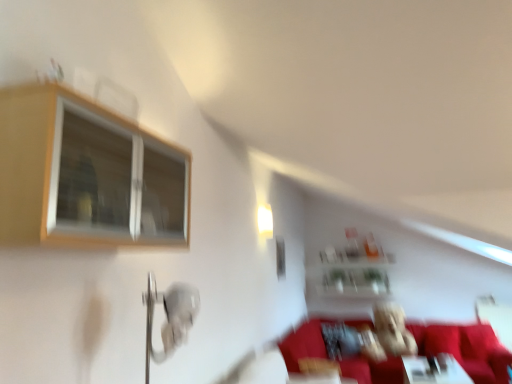
Question: Is fuzzy fabric teddy bear at center wider than white glossy light fixture at upper center?

Choices:
 (A) yes
 (B) no

Answer: (A)

Question: Does fuzzy fabric teddy bear at center come behind white glossy light fixture at upper center?

Choices:
 (A) no
 (B) yes

Answer: (B)

Question: Can you confirm if fuzzy fabric teddy bear at center is positioned to the left of white glossy light fixture at upper center?

Choices:
 (A) no
 (B) yes

Answer: (A)

Question: Does fuzzy fabric teddy bear at center turn towards white glossy light fixture at upper center?

Choices:
 (A) no
 (B) yes

Answer: (A)

Question: From a real-world perspective, is fuzzy fabric teddy bear at center on top of white glossy light fixture at upper center?

Choices:
 (A) yes
 (B) no

Answer: (B)

Question: From the image's perspective, is fuzzy fabric teddy bear at center below white glossy light fixture at upper center?

Choices:
 (A) no
 (B) yes

Answer: (B)

Question: Is there a large distance between wooden frame window at upper left and white glossy table at lower right?

Choices:
 (A) no
 (B) yes

Answer: (B)

Question: Is wooden frame window at upper left facing towards white glossy table at lower right?

Choices:
 (A) no
 (B) yes

Answer: (A)

Question: Is wooden frame window at upper left smaller than white glossy table at lower right?

Choices:
 (A) no
 (B) yes

Answer: (B)

Question: Is wooden frame window at upper left positioned beyond the bounds of white glossy table at lower right?

Choices:
 (A) yes
 (B) no

Answer: (A)

Question: Is wooden frame window at upper left closer to the viewer compared to white glossy table at lower right?

Choices:
 (A) yes
 (B) no

Answer: (A)

Question: Does wooden frame window at upper left have a larger size compared to white glossy table at lower right?

Choices:
 (A) no
 (B) yes

Answer: (A)

Question: Is wooden frame window at upper left wider than white glossy light fixture at upper center?

Choices:
 (A) yes
 (B) no

Answer: (A)